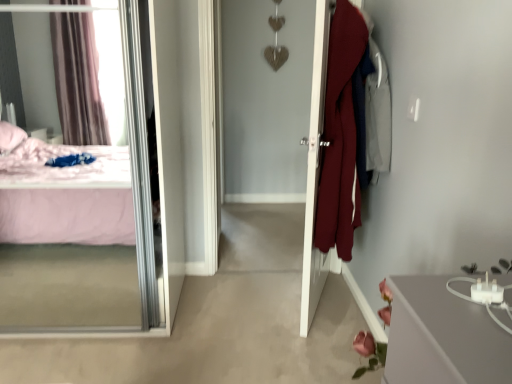
Image resolution: width=512 pixels, height=384 pixels. Identify the location of empty space that is in between white glossy door at center and transparent glass mirror at left. (222, 306).